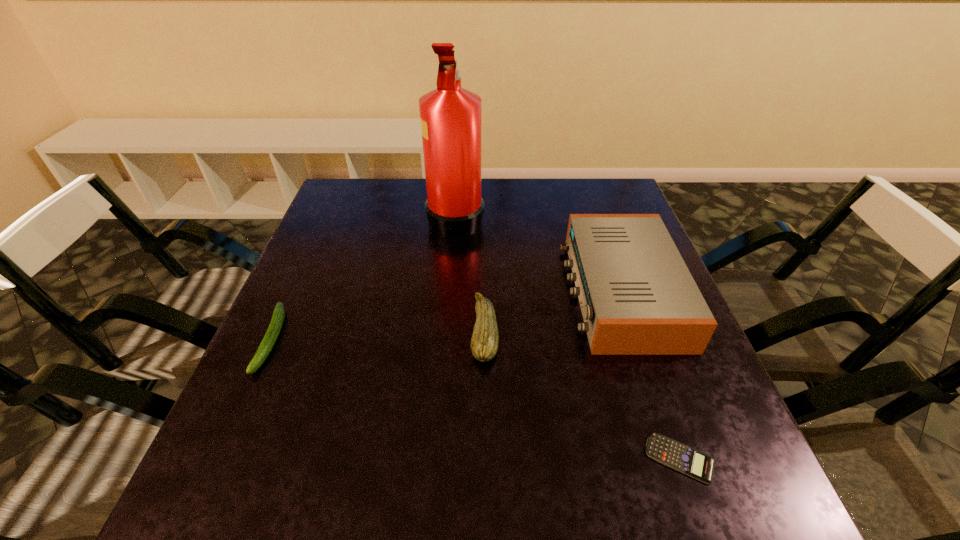
The height and width of the screenshot is (540, 960). I want to click on radio receiver at the right edge, so click(637, 297).

This screenshot has width=960, height=540. In order to click on calculator located in the right edge section of the desktop in this screenshot , I will do `click(678, 456)`.

At what (x,y) coordinates should I click in order to perform the action: click on object that is at the near right corner. Please return your answer as a coordinate pair (x, y). Image resolution: width=960 pixels, height=540 pixels. Looking at the image, I should click on (678, 456).

Locate an element on the screen. The image size is (960, 540). free space at the far edge of the desktop is located at coordinates (509, 184).

This screenshot has width=960, height=540. In the image, there is a desktop. Find the location of `vacant space at the near edge`. vacant space at the near edge is located at coordinates (637, 474).

At what (x,y) coordinates should I click in order to perform the action: click on vacant space at the left edge of the desktop. Please return your answer as a coordinate pair (x, y). Looking at the image, I should click on (264, 450).

Where is `vacant space at the near left corner of the desktop`? Image resolution: width=960 pixels, height=540 pixels. vacant space at the near left corner of the desktop is located at coordinates (209, 472).

At what (x,y) coordinates should I click in order to perform the action: click on free space at the far right corner of the desktop. Please return your answer as a coordinate pair (x, y). This screenshot has height=540, width=960. Looking at the image, I should click on (589, 180).

You are a GUI agent. You are given a task and a screenshot of the screen. Output one action in this format:
    pyautogui.click(x=<x>, y=<y>)
    Task: Click on the free point between the radio receiver and the tallest object
    
    Given the screenshot: What is the action you would take?
    pyautogui.click(x=539, y=254)

Where is `free point between the fourth tallest object and the right zucchini`? free point between the fourth tallest object and the right zucchini is located at coordinates (378, 335).